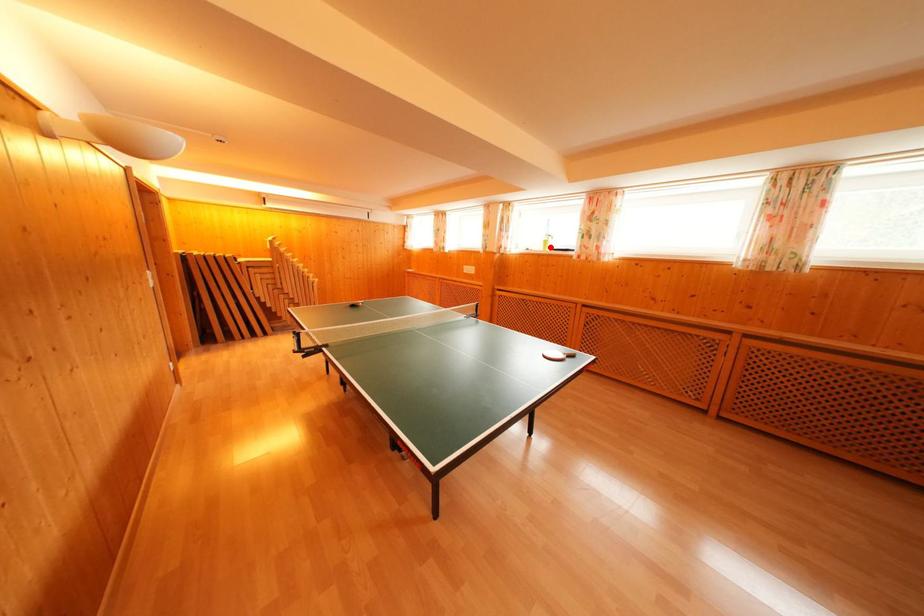
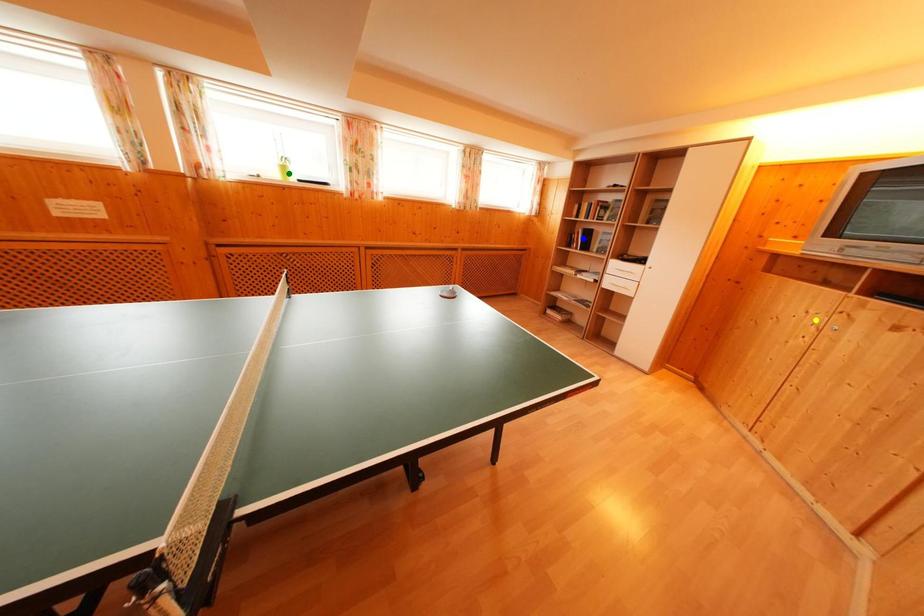
Question: I am providing you with two images of the same scene from different viewpoints. A red point is marked on the first image. You are given multiple points on the second image. Which spot in image 2 lines up with the point in image 1?

Choices:
 (A) green point
 (B) blue point
 (C) yellow point

Answer: (A)